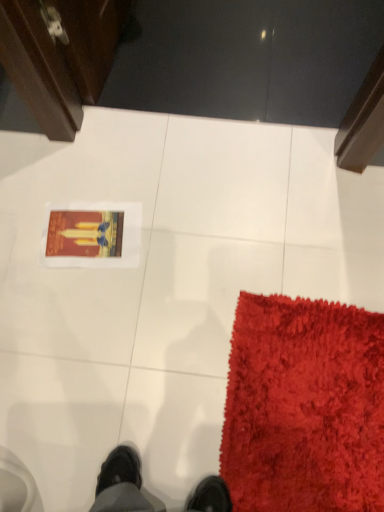
Where is `vacant space underneath shaggy red rug at lower right (from a real-world perspective)`? This screenshot has height=512, width=384. vacant space underneath shaggy red rug at lower right (from a real-world perspective) is located at coordinates (304, 412).